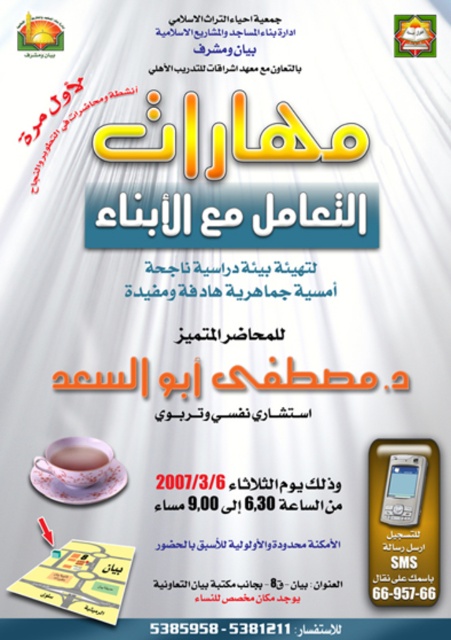
You are organizing a children event and need to place a pink porcelain teacup at lower left and a matte plastic smartphone at center. Based on the scene description, can you determine which object is placed higher?

The pink porcelain teacup at lower left is located above the matte plastic smartphone at center, so the pink porcelain teacup at lower left is placed higher.

You are standing in front of the promotional poster for the event. There are two points marked on the poster at coordinates point (105, 465) and point (77, 468). Which point is closer to you?

Point (77, 468) is closer to you because it is less further to the viewer than point (105, 465).